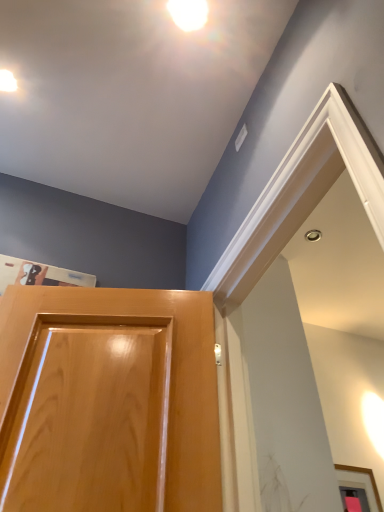
You are a GUI agent. You are given a task and a screenshot of the screen. Output one action in this format:
    pyautogui.click(x=<x>, y=<y>)
    Task: Click on the glossy wood door at lower left
    This screenshot has width=384, height=512.
    Given the screenshot: What is the action you would take?
    pyautogui.click(x=108, y=401)

Describe the element at coordinates (7, 81) in the screenshot. Image resolution: width=384 pixels, height=512 pixels. I see `matte white droplight at upper left, which is counted as the 1th droplight, starting from the left` at that location.

Locate an element on the screen. This screenshot has width=384, height=512. glossy wood door at lower left is located at coordinates (108, 401).

Can you tell me how much matte white droplight at upper left, the 2th droplight positioned from the top, and white glossy droplight at upper center, the 2th droplight viewed from the left, differ in facing direction?

The angular difference between matte white droplight at upper left, the 2th droplight positioned from the top, and white glossy droplight at upper center, the 2th droplight viewed from the left, is 1.18 degrees.

Does matte white droplight at upper left, which ranks as the first droplight in back-to-front order, have a smaller size compared to white glossy droplight at upper center, acting as the first droplight starting from the top?

Incorrect, matte white droplight at upper left, which ranks as the first droplight in back-to-front order, is not smaller in size than white glossy droplight at upper center, acting as the first droplight starting from the top.

Would you say matte white droplight at upper left, the 2th droplight positioned from the top, contains white glossy droplight at upper center, the first droplight in the front-to-back sequence?

No, white glossy droplight at upper center, the first droplight in the front-to-back sequence, is not inside matte white droplight at upper left, the 2th droplight positioned from the top.

Considering the relative positions of matte white droplight at upper left, which is counted as the second droplight, starting from the right, and white glossy droplight at upper center, the 2th droplight viewed from the left, in the image provided, is matte white droplight at upper left, which is counted as the second droplight, starting from the right, to the right of white glossy droplight at upper center, the 2th droplight viewed from the left, from the viewer's perspective?

Incorrect, matte white droplight at upper left, which is counted as the second droplight, starting from the right, is not on the right side of white glossy droplight at upper center, the 2th droplight viewed from the left.

From a real-world perspective, is glossy wood door at lower left located higher than white glossy droplight at upper center, the 2th droplight viewed from the left?

Actually, glossy wood door at lower left is physically below white glossy droplight at upper center, the 2th droplight viewed from the left, in the real world.

Is glossy wood door at lower left next to white glossy droplight at upper center, the 2th droplight viewed from the left?

glossy wood door at lower left and white glossy droplight at upper center, the 2th droplight viewed from the left, are not in contact.

Considering the sizes of objects glossy wood door at lower left and white glossy droplight at upper center, the 1th droplight from the right, in the image provided, who is wider, glossy wood door at lower left or white glossy droplight at upper center, the 1th droplight from the right,?

Wider between the two is glossy wood door at lower left.

Who is bigger, glossy wood door at lower left or white glossy droplight at upper center, acting as the first droplight starting from the top?

With larger size is glossy wood door at lower left.

Which of these two, glossy wood door at lower left or matte white droplight at upper left, which is counted as the second droplight, starting from the right, is thinner?

matte white droplight at upper left, which is counted as the second droplight, starting from the right.

Based on the photo, measure the distance from glossy wood door at lower left to matte white droplight at upper left, the 2th droplight positioned from the top.

The distance of glossy wood door at lower left from matte white droplight at upper left, the 2th droplight positioned from the top, is 1.18 meters.

Which is in front, point (104, 486) or point (12, 85)?

The point (104, 486) is more forward.

From a real-world perspective, is glossy wood door at lower left positioned above or below matte white droplight at upper left, which is counted as the second droplight, starting from the right?

From a real-world perspective, glossy wood door at lower left is physically below matte white droplight at upper left, which is counted as the second droplight, starting from the right.

What are the coordinates of `droplight lying on the right of matte white droplight at upper left, which is counted as the first droplight, starting from the bottom` in the screenshot? It's located at (188, 13).

Is white glossy droplight at upper center, acting as the first droplight starting from the top, facing towards matte white droplight at upper left, which is counted as the 1th droplight, starting from the left?

No, white glossy droplight at upper center, acting as the first droplight starting from the top, is not aimed at matte white droplight at upper left, which is counted as the 1th droplight, starting from the left.

Is white glossy droplight at upper center, the 2th droplight viewed from the left, next to matte white droplight at upper left, which is counted as the first droplight, starting from the bottom, and touching it?

No, white glossy droplight at upper center, the 2th droplight viewed from the left, is not beside matte white droplight at upper left, which is counted as the first droplight, starting from the bottom.

From the image's perspective, which one is positioned higher, white glossy droplight at upper center, the 1th droplight from the right, or glossy wood door at lower left?

white glossy droplight at upper center, the 1th droplight from the right, from the image's perspective.

What's the angular difference between white glossy droplight at upper center, the first droplight in the front-to-back sequence, and glossy wood door at lower left's facing directions?

108 degrees.

Is glossy wood door at lower left surrounded by white glossy droplight at upper center, the 2th droplight viewed from the left?

No, glossy wood door at lower left is not surrounded by white glossy droplight at upper center, the 2th droplight viewed from the left.

From a real-world perspective, is white glossy droplight at upper center, acting as the first droplight starting from the top, beneath glossy wood door at lower left?

No, from a real-world perspective, white glossy droplight at upper center, acting as the first droplight starting from the top, is not below glossy wood door at lower left.

Considering the sizes of objects matte white droplight at upper left, which appears as the 2th droplight when viewed from the front, and glossy wood door at lower left in the image provided, who is shorter, matte white droplight at upper left, which appears as the 2th droplight when viewed from the front, or glossy wood door at lower left?

matte white droplight at upper left, which appears as the 2th droplight when viewed from the front, is shorter.

Consider the image. Is matte white droplight at upper left, which ranks as the first droplight in back-to-front order, outside of glossy wood door at lower left?

Yes, matte white droplight at upper left, which ranks as the first droplight in back-to-front order, is located beyond the bounds of glossy wood door at lower left.

Is matte white droplight at upper left, which appears as the 2th droplight when viewed from the front, to the left or to the right of glossy wood door at lower left in the image?

In the image, matte white droplight at upper left, which appears as the 2th droplight when viewed from the front, appears on the left side of glossy wood door at lower left.

Does matte white droplight at upper left, which appears as the 2th droplight when viewed from the front, have a smaller size compared to glossy wood door at lower left?

Correct, matte white droplight at upper left, which appears as the 2th droplight when viewed from the front, occupies less space than glossy wood door at lower left.

In the image, there is a matte white droplight at upper left, which is counted as the first droplight, starting from the bottom. In order to click on droplight above it (from the image's perspective) in this screenshot , I will do `click(188, 13)`.

Find the location of a particular element. This screenshot has height=512, width=384. door below the white glossy droplight at upper center, acting as the first droplight starting from the top (from a real-world perspective) is located at coordinates (108, 401).

Considering their positions, is matte white droplight at upper left, which appears as the 2th droplight when viewed from the front, positioned closer to white glossy droplight at upper center, acting as the 2th droplight starting from the back, than glossy wood door at lower left?

Based on the image, matte white droplight at upper left, which appears as the 2th droplight when viewed from the front, appears to be nearer to white glossy droplight at upper center, acting as the 2th droplight starting from the back.

Looking at this image, which object lies further to the anchor point glossy wood door at lower left, matte white droplight at upper left, which is counted as the 1th droplight, starting from the left, or white glossy droplight at upper center, the 1th droplight from the right?

white glossy droplight at upper center, the 1th droplight from the right, is further to glossy wood door at lower left.

Estimate the real-world distances between objects in this image. Which object is further from matte white droplight at upper left, which is counted as the second droplight, starting from the right, white glossy droplight at upper center, the 2th droplight when ordered from bottom to top, or glossy wood door at lower left?

Based on the image, glossy wood door at lower left appears to be further to matte white droplight at upper left, which is counted as the second droplight, starting from the right.

Estimate the real-world distances between objects in this image. Which object is further from matte white droplight at upper left, which appears as the 2th droplight when viewed from the front, glossy wood door at lower left or white glossy droplight at upper center, acting as the first droplight starting from the top?

Among the two, glossy wood door at lower left is located further to matte white droplight at upper left, which appears as the 2th droplight when viewed from the front.

Looking at this image, looking at the image, which one is located closer to white glossy droplight at upper center, acting as the 2th droplight starting from the back, glossy wood door at lower left or matte white droplight at upper left, which is counted as the first droplight, starting from the bottom?

matte white droplight at upper left, which is counted as the first droplight, starting from the bottom, is closer to white glossy droplight at upper center, acting as the 2th droplight starting from the back.

When comparing their distances from glossy wood door at lower left, does white glossy droplight at upper center, the 2th droplight viewed from the left, or matte white droplight at upper left, which is counted as the first droplight, starting from the bottom, seem closer?

Among the two, matte white droplight at upper left, which is counted as the first droplight, starting from the bottom, is located nearer to glossy wood door at lower left.

Identify the location of droplight that lies between white glossy droplight at upper center, acting as the 2th droplight starting from the back, and glossy wood door at lower left from top to bottom. The width and height of the screenshot is (384, 512). (7, 81).